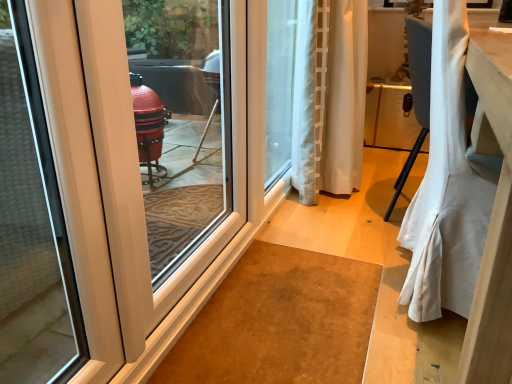
I want to click on free space that is to the left of white fabric curtain at right, which ranks as the 1th curtain in front-to-back order, so click(x=334, y=291).